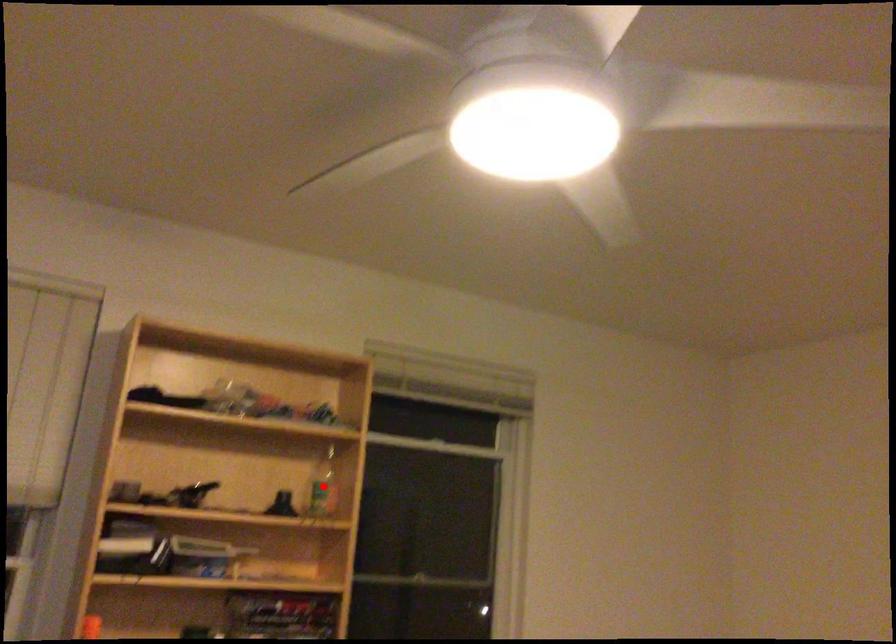
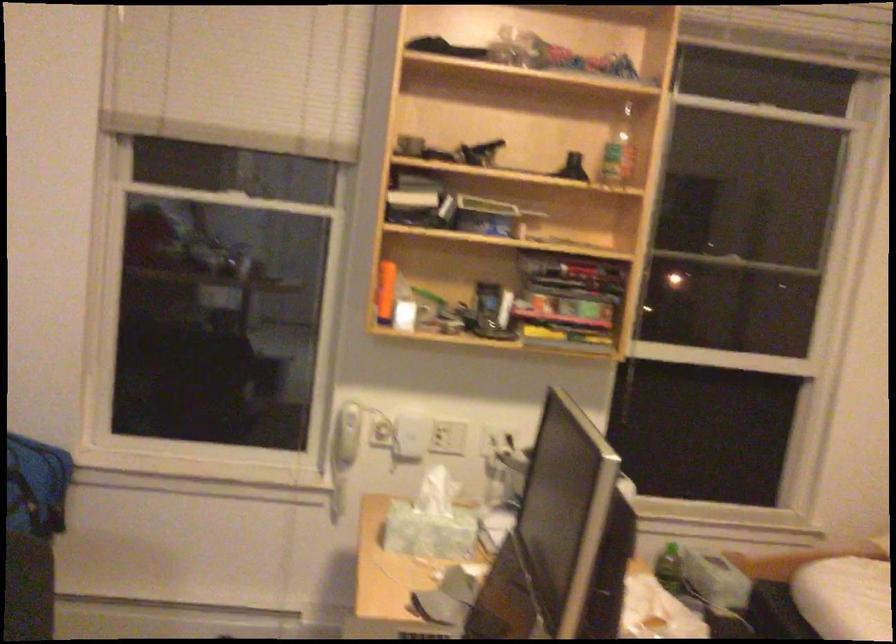
Question: I am providing you with two images of the same scene from different viewpoints. A red point is marked on the first image. At the location where the point appears in image 1, is it still visible in image 2?

Choices:
 (A) Yes
 (B) No

Answer: (A)